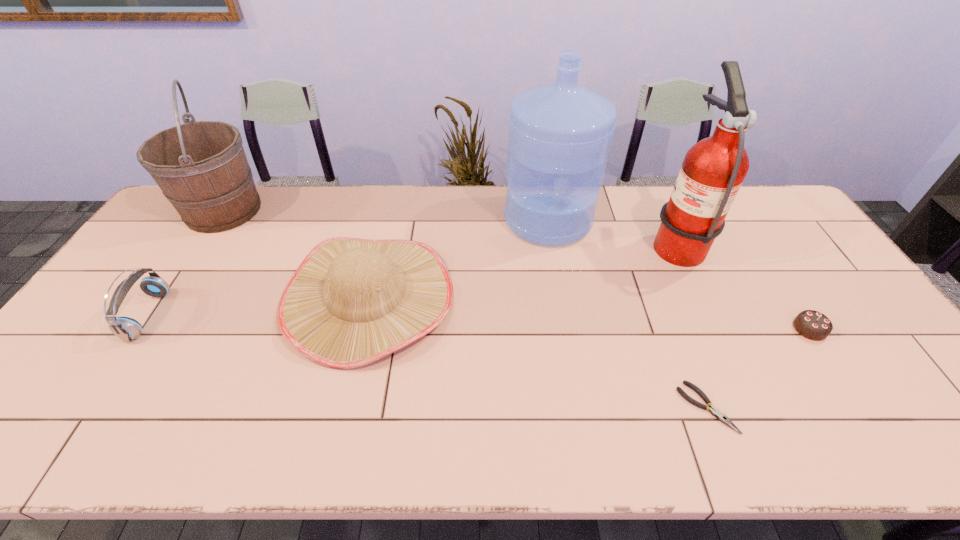
The height and width of the screenshot is (540, 960). I want to click on water jug, so click(560, 133).

This screenshot has width=960, height=540. I want to click on fire extinguisher, so click(x=713, y=170).

Locate an element on the screen. The height and width of the screenshot is (540, 960). the third tallest object is located at coordinates (201, 167).

Locate an element on the screen. This screenshot has width=960, height=540. the fifth object from right to left is located at coordinates (351, 302).

The image size is (960, 540). I want to click on sunhat, so click(x=351, y=302).

Locate an element on the screen. The width and height of the screenshot is (960, 540). the fifth tallest object is located at coordinates (127, 329).

Image resolution: width=960 pixels, height=540 pixels. I want to click on the sixth tallest object, so click(813, 325).

The height and width of the screenshot is (540, 960). Find the location of `the rightmost object`. the rightmost object is located at coordinates (813, 325).

Locate an element on the screen. The width and height of the screenshot is (960, 540). pliers is located at coordinates (719, 415).

At what (x,y) coordinates should I click in order to perform the action: click on the nearest object. Please return your answer as a coordinate pair (x, y). The width and height of the screenshot is (960, 540). Looking at the image, I should click on (719, 415).